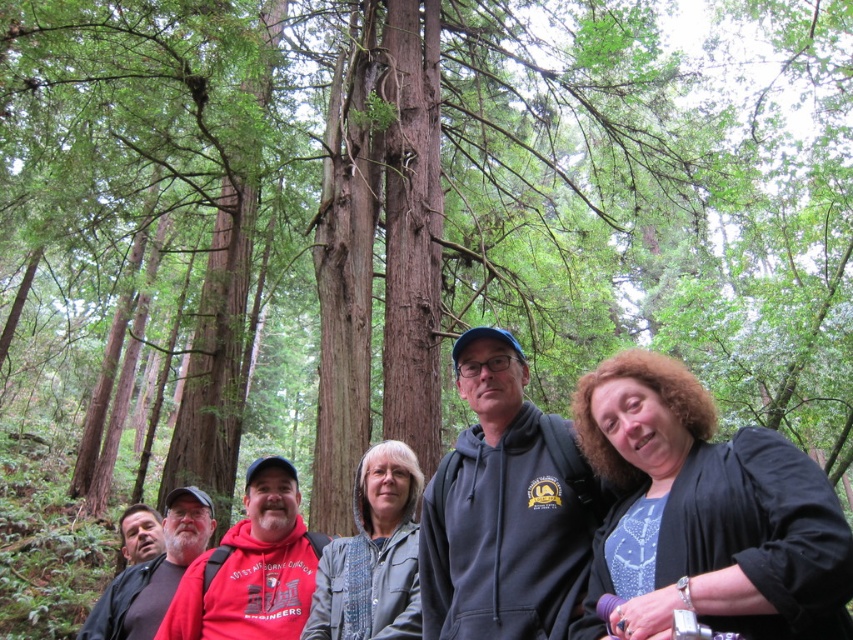
Is black matte jacket at lower right closer to camera compared to dark gray hoodie at center?

Yes, black matte jacket at lower right is closer to the viewer.

What do you see at coordinates (706, 512) in the screenshot? Image resolution: width=853 pixels, height=640 pixels. I see `black matte jacket at lower right` at bounding box center [706, 512].

Image resolution: width=853 pixels, height=640 pixels. Find the location of `black matte jacket at lower right`. black matte jacket at lower right is located at coordinates (706, 512).

Where is `black matte jacket at lower right`? The image size is (853, 640). black matte jacket at lower right is located at coordinates (706, 512).

Which is behind, point (515, 385) or point (357, 490)?

Positioned behind is point (357, 490).

Can you confirm if dark gray hoodie at center is bigger than gray textured jacket at center?

Yes, dark gray hoodie at center is bigger than gray textured jacket at center.

Image resolution: width=853 pixels, height=640 pixels. What do you see at coordinates (505, 509) in the screenshot?
I see `dark gray hoodie at center` at bounding box center [505, 509].

What are the coordinates of `dark gray hoodie at center` in the screenshot? It's located at (505, 509).

Can you confirm if gray textured jacket at center is positioned to the right of red hoodie at left?

Correct, you'll find gray textured jacket at center to the right of red hoodie at left.

Between gray textured jacket at center and red hoodie at left, which one has more height?

Standing taller between the two is red hoodie at left.

Where is `gray textured jacket at center`? gray textured jacket at center is located at coordinates (373, 556).